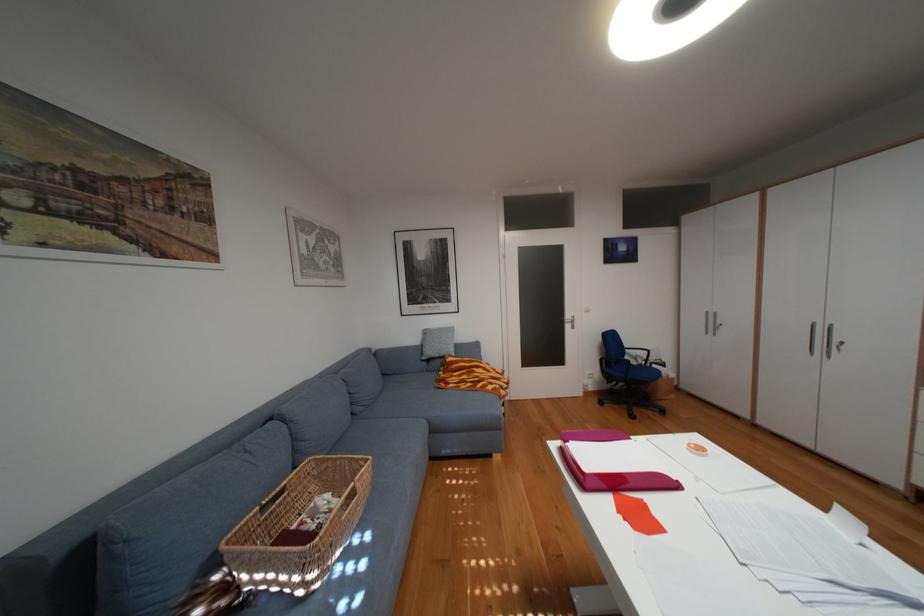
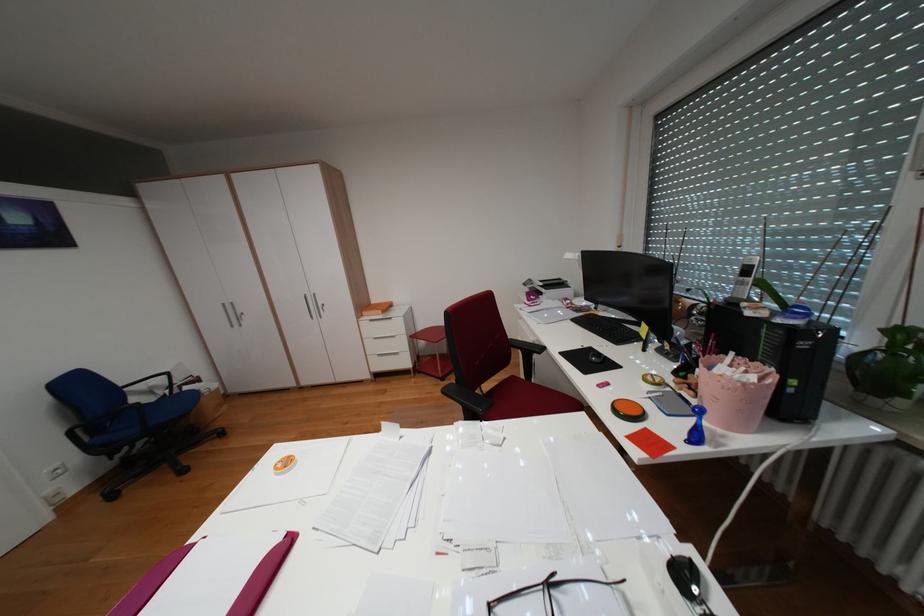
Question: The camera is either moving clockwise (left) or counter-clockwise (right) around the object. The first image is from the beginning of the video and the second image is from the end. Is the camera moving left or right when shooting the video?

Choices:
 (A) Left
 (B) Right

Answer: (A)